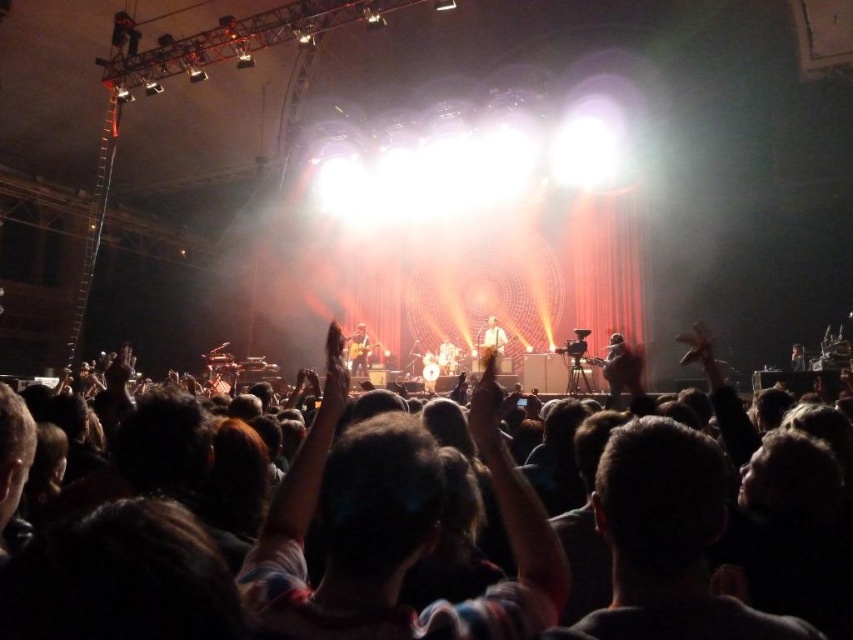
Question: Does light brown leather guitar at center have a lesser width compared to matte black guitar at center?

Choices:
 (A) no
 (B) yes

Answer: (A)

Question: Is light brown leather guitar at center above matte black guitar at center?

Choices:
 (A) yes
 (B) no

Answer: (A)

Question: Is light brown leather guitar at center positioned in front of matte black guitar at center?

Choices:
 (A) no
 (B) yes

Answer: (B)

Question: Which point is closer to the camera taking this photo?

Choices:
 (A) click(358, 372)
 (B) click(490, 336)

Answer: (B)

Question: Which point is closer to the camera?

Choices:
 (A) light brown leather guitar at center
 (B) matte black guitar at center

Answer: (A)